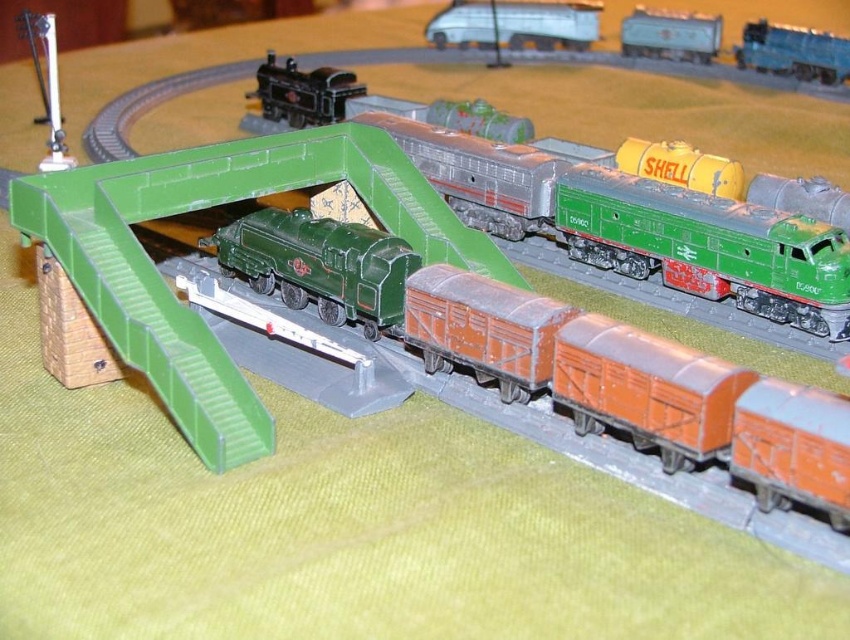
Can you confirm if green matte train at center is taller than metallic silver truck at upper center?

Indeed, green matte train at center has a greater height compared to metallic silver truck at upper center.

Describe the element at coordinates (554, 355) in the screenshot. I see `green matte train at center` at that location.

Describe the element at coordinates (554, 355) in the screenshot. I see `green matte train at center` at that location.

The image size is (850, 640). Identify the location of green matte train at center. 554,355.

Does green matte train at center have a lesser height compared to green matte locomotive at center?

No, green matte train at center is not shorter than green matte locomotive at center.

Between green matte train at center and green matte locomotive at center, which one is positioned lower?

Positioned lower is green matte train at center.

This screenshot has height=640, width=850. What do you see at coordinates (554, 355) in the screenshot? I see `green matte train at center` at bounding box center [554, 355].

The image size is (850, 640). I want to click on green matte train at center, so click(554, 355).

In the scene shown: Is green matte train at center bigger than metallic blue tank car at upper right?

Yes, green matte train at center is bigger than metallic blue tank car at upper right.

Does green matte train at center appear over metallic blue tank car at upper right?

Incorrect, green matte train at center is not positioned above metallic blue tank car at upper right.

Is point (476, 340) behind point (653, 20)?

No, it is not.

Locate an element on the screen. This screenshot has height=640, width=850. green matte train at center is located at coordinates (554, 355).